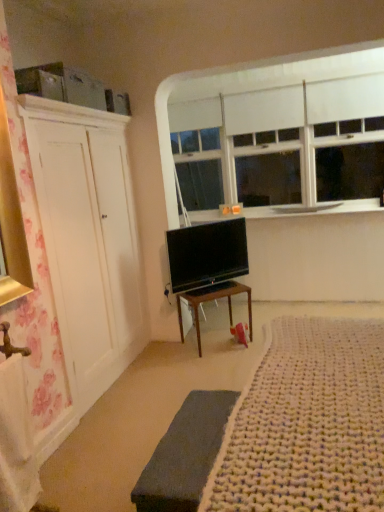
Question: Is wooden desk at center a part of white matte window at upper center?

Choices:
 (A) yes
 (B) no

Answer: (B)

Question: Is white matte window at upper center oriented away from wooden desk at center?

Choices:
 (A) yes
 (B) no

Answer: (B)

Question: Is white matte window at upper center aimed at wooden desk at center?

Choices:
 (A) no
 (B) yes

Answer: (A)

Question: Are white matte window at upper center and wooden desk at center located far from each other?

Choices:
 (A) no
 (B) yes

Answer: (B)

Question: From the image's perspective, would you say white matte window at upper center is positioned over wooden desk at center?

Choices:
 (A) no
 (B) yes

Answer: (B)

Question: From the image's perspective, is white matte window at upper center above or below white smooth window sill at upper center?

Choices:
 (A) above
 (B) below

Answer: (A)

Question: Considering the positions of white matte window at upper center and white smooth window sill at upper center in the image, is white matte window at upper center wider or thinner than white smooth window sill at upper center?

Choices:
 (A) thin
 (B) wide

Answer: (A)

Question: Is white matte window at upper center taller or shorter than white smooth window sill at upper center?

Choices:
 (A) tall
 (B) short

Answer: (A)

Question: Which is correct: white matte window at upper center is inside white smooth window sill at upper center, or outside of it?

Choices:
 (A) outside
 (B) inside

Answer: (A)

Question: Considering the positions of flat screen tv at center and dark gray fabric bed frame at lower center in the image, is flat screen tv at center wider or thinner than dark gray fabric bed frame at lower center?

Choices:
 (A) thin
 (B) wide

Answer: (A)

Question: Considering the positions of flat screen tv at center and dark gray fabric bed frame at lower center in the image, is flat screen tv at center bigger or smaller than dark gray fabric bed frame at lower center?

Choices:
 (A) small
 (B) big

Answer: (A)

Question: Would you say flat screen tv at center is to the left or to the right of dark gray fabric bed frame at lower center in the picture?

Choices:
 (A) left
 (B) right

Answer: (B)

Question: From the image's perspective, is flat screen tv at center located above or below dark gray fabric bed frame at lower center?

Choices:
 (A) below
 (B) above

Answer: (B)

Question: From a real-world perspective, is white matte window at upper center physically located above or below dark gray fabric bed frame at lower center?

Choices:
 (A) above
 (B) below

Answer: (A)

Question: From their relative heights in the image, would you say white matte window at upper center is taller or shorter than dark gray fabric bed frame at lower center?

Choices:
 (A) tall
 (B) short

Answer: (A)